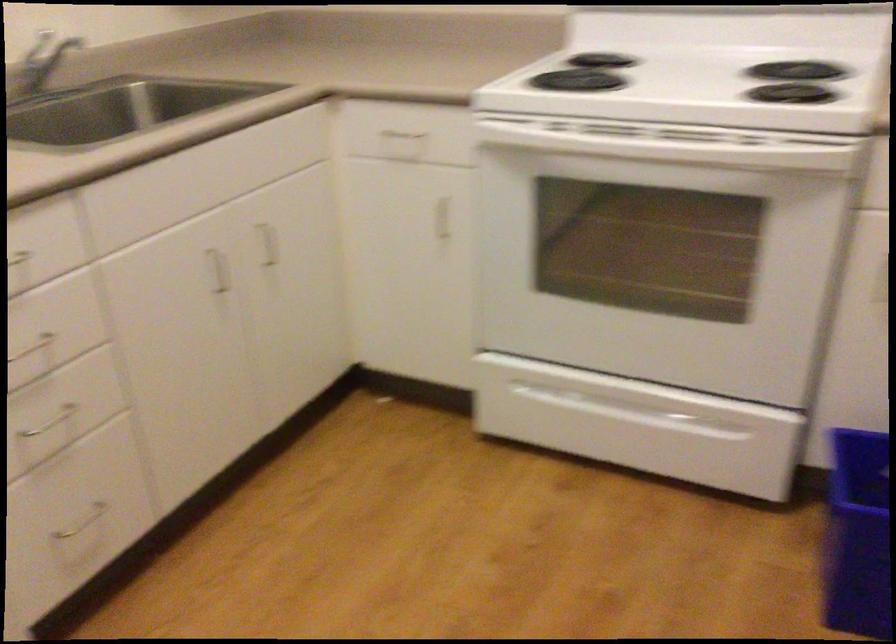
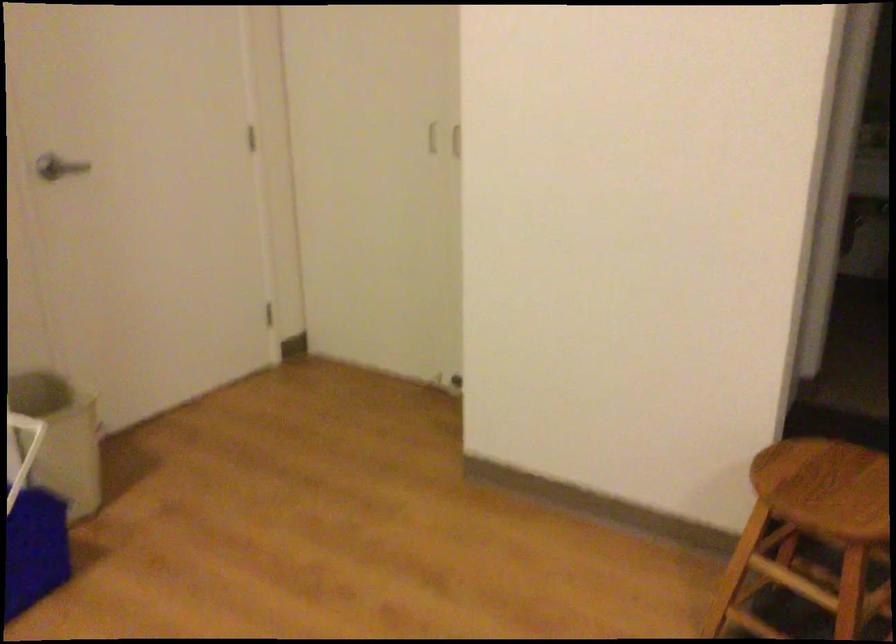
Question: The first image is from the beginning of the video and the second image is from the end. How did the camera likely rotate when shooting the video?

Choices:
 (A) Left
 (B) Right
 (C) Up
 (D) Down

Answer: (B)